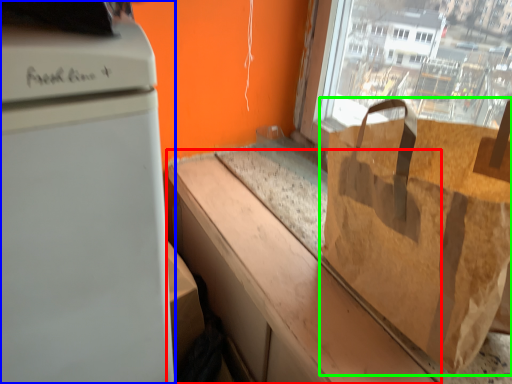
Question: Which object is positioned closest to counter top (highlighted by a red box)? Select from home appliance (highlighted by a blue box) and grocery bag (highlighted by a green box).

Choices:
 (A) home appliance
 (B) grocery bag

Answer: (B)